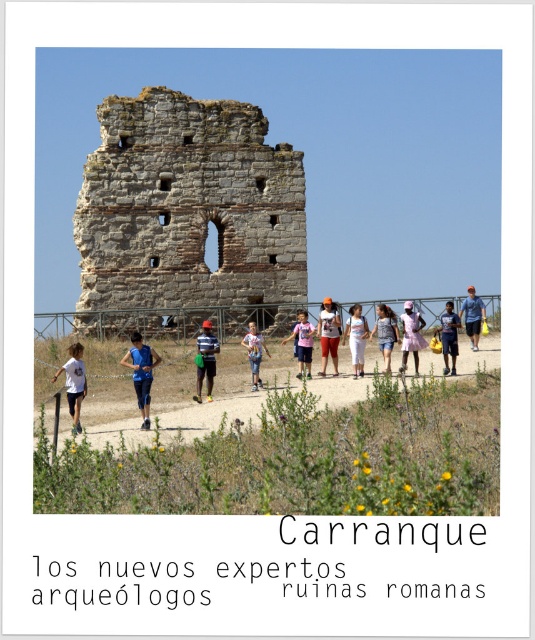
Question: Which of the following is the farthest from the observer?

Choices:
 (A) (414, 349)
 (B) (147, 422)
 (C) (391, 332)

Answer: (C)

Question: Does denim shorts at center have a lesser width compared to white cotton shirt at center?

Choices:
 (A) no
 (B) yes

Answer: (A)

Question: Does brown dirt path at center appear on the right side of matte black backpack at center?

Choices:
 (A) yes
 (B) no

Answer: (B)

Question: Based on their relative distances, which object is farther from the gray stone tower at center?

Choices:
 (A) blue fabric shirt at center
 (B) matte orange shirt at center
 (C) denim shorts at center
 (D) white cotton dress at center

Answer: (B)

Question: Can you confirm if white cotton shirt at lower left is positioned to the right of matte orange shirt at center?

Choices:
 (A) yes
 (B) no

Answer: (B)

Question: Which point is farther to the camera?

Choices:
 (A) (411, 320)
 (B) (385, 362)
 (C) (210, 380)

Answer: (A)